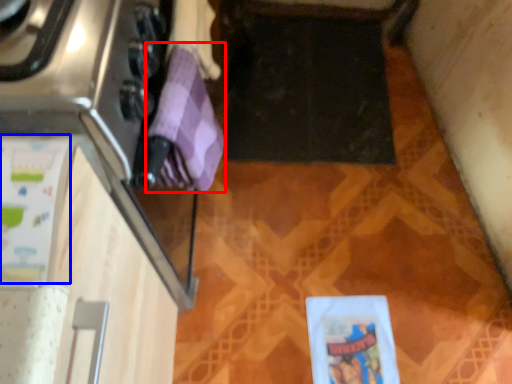
Question: Which of the following is the closest to the observer, wrapping paper (highlighted by a red box) or wrapping paper (highlighted by a blue box)?

Choices:
 (A) wrapping paper
 (B) wrapping paper

Answer: (B)